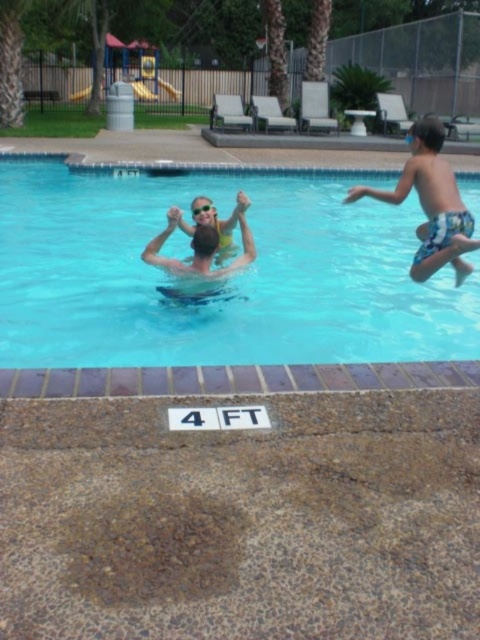
You are standing at the edge of the pool and want to jump into the clear blue water at center. Based on the coordinates provided, is the water directly in front of you or to the side?

The clear blue water at center is located at point (228,280), which means it is directly in front of you since it is centered in the pool.

You are a swimmer who wants to retrieve the blue printed trunks at right from the pool. Based on the scene, can you reach them while staying in the clear blue water at center without getting out?

The clear blue water at center is located above the blue printed trunks at right, meaning the water level is above the trunks. Therefore, you can reach the blue printed trunks at right while staying in the clear blue water at center without needing to exit the pool.